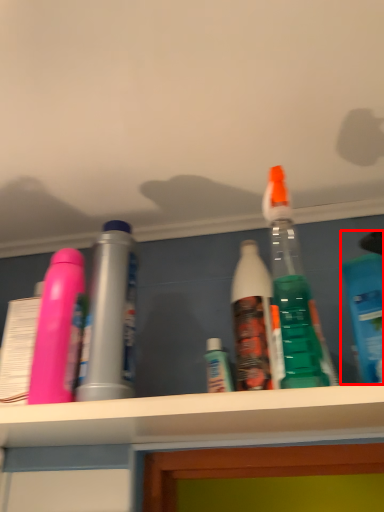
Question: Observing the image, what is the correct spatial positioning of bottle (annotated by the red box) in reference to bottle?

Choices:
 (A) left
 (B) right

Answer: (B)